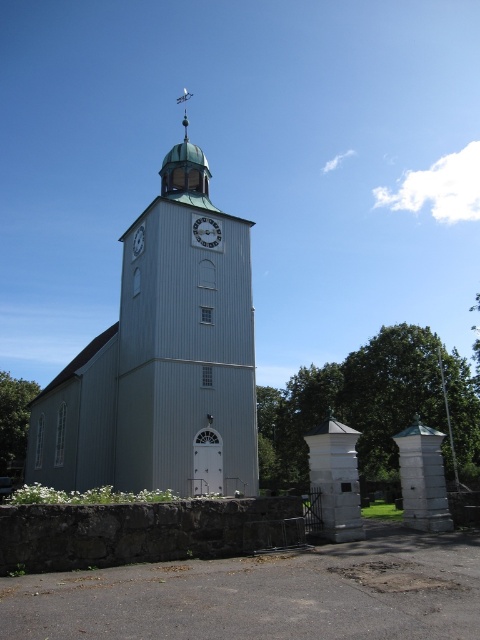
Question: Where is gray wooden church at center located in relation to white wooden clock at center in the image?

Choices:
 (A) above
 (B) below

Answer: (B)

Question: Which point is farther to the camera?

Choices:
 (A) white wooden clock at center
 (B) green copper spire at upper center
 (C) white wooden clock at upper center
 (D) gray wooden church at center

Answer: (B)

Question: Which object is the closest to the white wooden clock at upper center?

Choices:
 (A) gray wooden church at center
 (B) white wooden clock at center

Answer: (B)

Question: Is white wooden clock at center behind white wooden clock at upper center?

Choices:
 (A) no
 (B) yes

Answer: (A)

Question: Can you confirm if white wooden clock at center is wider than white wooden clock at upper center?

Choices:
 (A) no
 (B) yes

Answer: (B)

Question: Which object is closer to the camera taking this photo?

Choices:
 (A) white wooden clock at center
 (B) green copper spire at upper center
 (C) white wooden clock at upper center

Answer: (A)